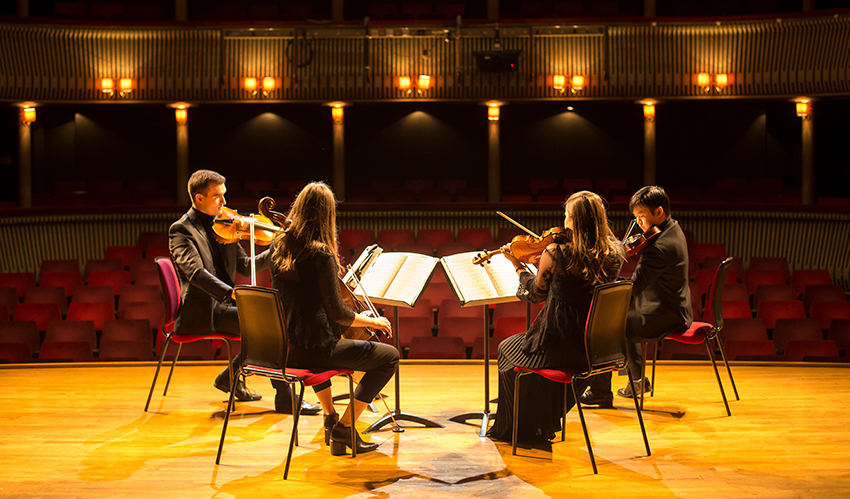
At what (x,y) coordinates should I click in order to perform the action: click on theater wall acoustics. Please return your answer as a coordinate pair (x, y). Looking at the image, I should click on (150, 62), (262, 53), (570, 53), (755, 48), (71, 235), (755, 270).